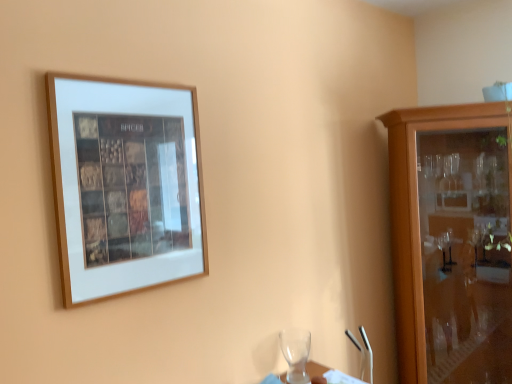
Question: From a real-world perspective, is wooden picture frame at upper left physically below wooden cabinet at right?

Choices:
 (A) yes
 (B) no

Answer: (B)

Question: Is wooden picture frame at upper left positioned behind wooden cabinet at right?

Choices:
 (A) yes
 (B) no

Answer: (B)

Question: From a real-world perspective, is wooden picture frame at upper left positioned over wooden cabinet at right based on gravity?

Choices:
 (A) yes
 (B) no

Answer: (A)

Question: Considering the relative sizes of wooden picture frame at upper left and wooden cabinet at right in the image provided, is wooden picture frame at upper left thinner than wooden cabinet at right?

Choices:
 (A) yes
 (B) no

Answer: (A)

Question: Does wooden picture frame at upper left have a larger size compared to wooden cabinet at right?

Choices:
 (A) no
 (B) yes

Answer: (A)

Question: Based on their positions, is transparent glass wine glass at lower center located to the left or right of wooden cabinet at right?

Choices:
 (A) left
 (B) right

Answer: (A)

Question: Is transparent glass wine glass at lower center taller or shorter than wooden cabinet at right?

Choices:
 (A) short
 (B) tall

Answer: (A)

Question: Is point (282, 347) closer or farther from the camera than point (399, 218)?

Choices:
 (A) closer
 (B) farther

Answer: (A)

Question: From the image's perspective, relative to wooden cabinet at right, is transparent glass wine glass at lower center above or below?

Choices:
 (A) above
 (B) below

Answer: (B)

Question: Considering their positions, is wooden cabinet at right located in front of or behind transparent glass wine glass at lower center?

Choices:
 (A) behind
 (B) front

Answer: (A)

Question: Is wooden cabinet at right taller or shorter than transparent glass wine glass at lower center?

Choices:
 (A) tall
 (B) short

Answer: (A)

Question: Is wooden cabinet at right inside or outside of transparent glass wine glass at lower center?

Choices:
 (A) outside
 (B) inside

Answer: (A)

Question: Considering the relative positions of wooden cabinet at right and transparent glass wine glass at lower center in the image provided, is wooden cabinet at right to the left or to the right of transparent glass wine glass at lower center?

Choices:
 (A) left
 (B) right

Answer: (B)

Question: Does point (300, 364) appear closer or farther from the camera than point (182, 190)?

Choices:
 (A) closer
 (B) farther

Answer: (B)

Question: Is transparent glass wine glass at lower center to the left or to the right of wooden picture frame at upper left in the image?

Choices:
 (A) right
 (B) left

Answer: (A)